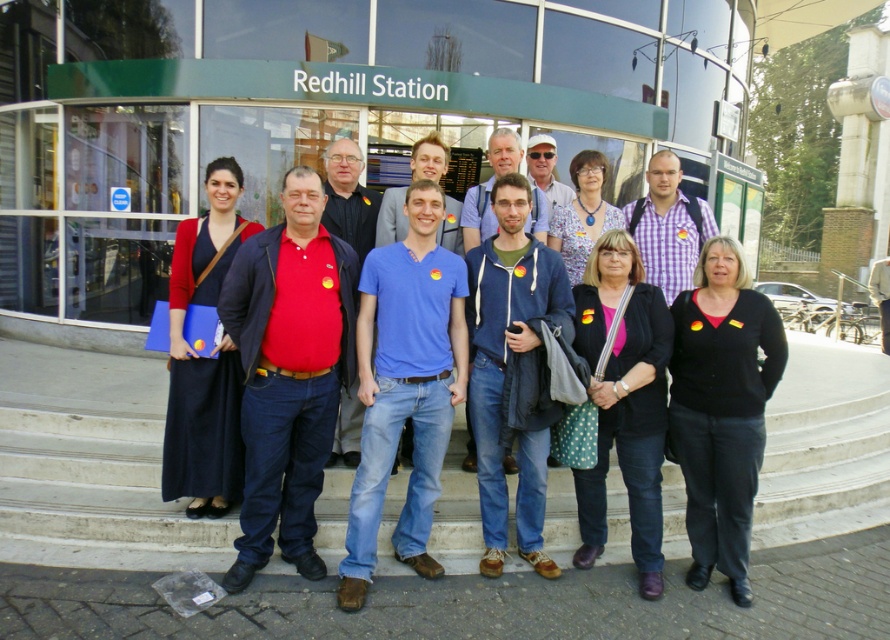
You are a photographer trying to adjust the focus on your camera. You need to ensure that both the black matte jacket at center and the floral fabric blouse at center are in sharp focus. Given their sizes, which object should you focus on to maximize the chances of both being clear?

The black matte jacket at center is bigger than the floral fabric blouse at center. To maximize clarity for both, focus on the black matte jacket at center since larger objects generally require more precise focus adjustments, ensuring the smaller floral fabric blouse at center will also be in focus.

Based on the photo, you are a photographer trying to adjust the focus on your camera. You notice two items at the center of the group photo. Which one is taller between the black matte jacket at center and the floral fabric blouse at center?

The black matte jacket at center is taller than the floral fabric blouse at center according to the description.